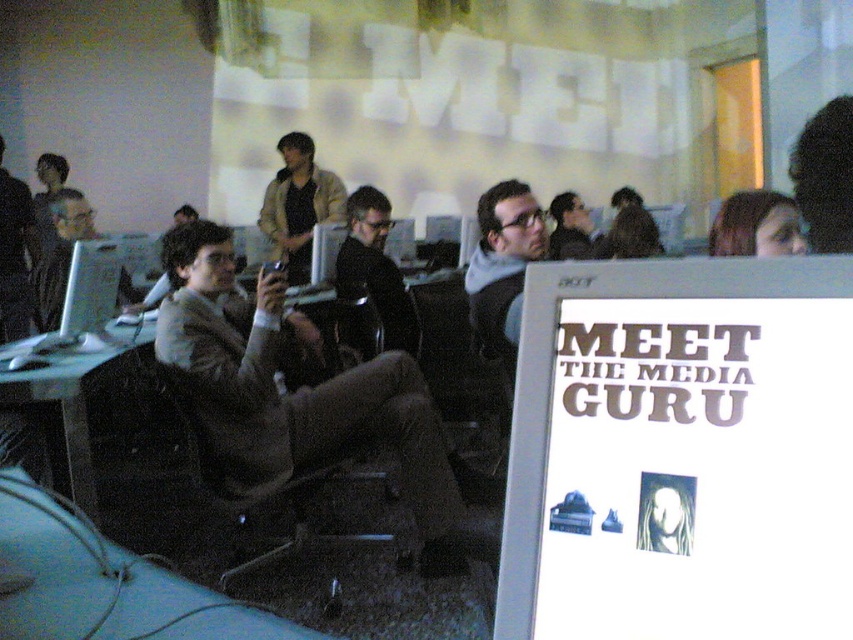
You are a GUI agent. You are given a task and a screenshot of the screen. Output one action in this format:
    pyautogui.click(x=<x>, y=<y>)
    Task: Click on the gray sweater at center
    The width and height of the screenshot is (853, 640).
    Given the screenshot: What is the action you would take?
    pyautogui.click(x=502, y=264)

Between point (496, 352) and point (751, 216), which one is positioned in front?

Point (751, 216)

Which is behind, point (505, 308) or point (798, 252)?

Point (505, 308)

Where is `gray sweater at center`? Image resolution: width=853 pixels, height=640 pixels. gray sweater at center is located at coordinates (502, 264).

Does black fabric swivel chair at center appear under matte black jacket at center?

Correct, black fabric swivel chair at center is located below matte black jacket at center.

Is point (389, 497) positioned before point (335, 259)?

Yes, it is.

Looking at this image, who is more forward, (173, 381) or (370, 234)?

Point (173, 381) is more forward.

Locate an element on the screen. black fabric swivel chair at center is located at coordinates (273, 497).

Does dark brown hair at upper right have a lesser width compared to matte black jacket at left?

Yes, dark brown hair at upper right is thinner than matte black jacket at left.

Between point (747, 218) and point (51, 296), which one is positioned behind?

The point (51, 296) is more distant.

The image size is (853, 640). I want to click on dark brown hair at upper right, so click(x=756, y=225).